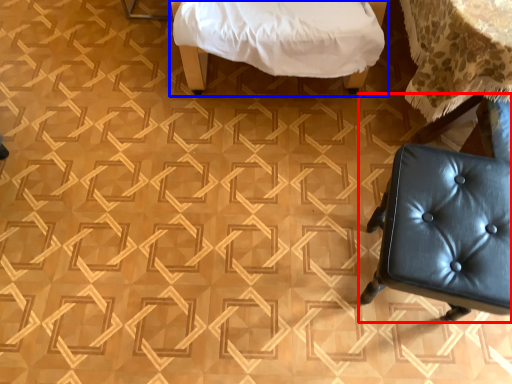
Question: Which object is further to the camera taking this photo, chair (highlighted by a red box) or furniture (highlighted by a blue box)?

Choices:
 (A) chair
 (B) furniture

Answer: (B)